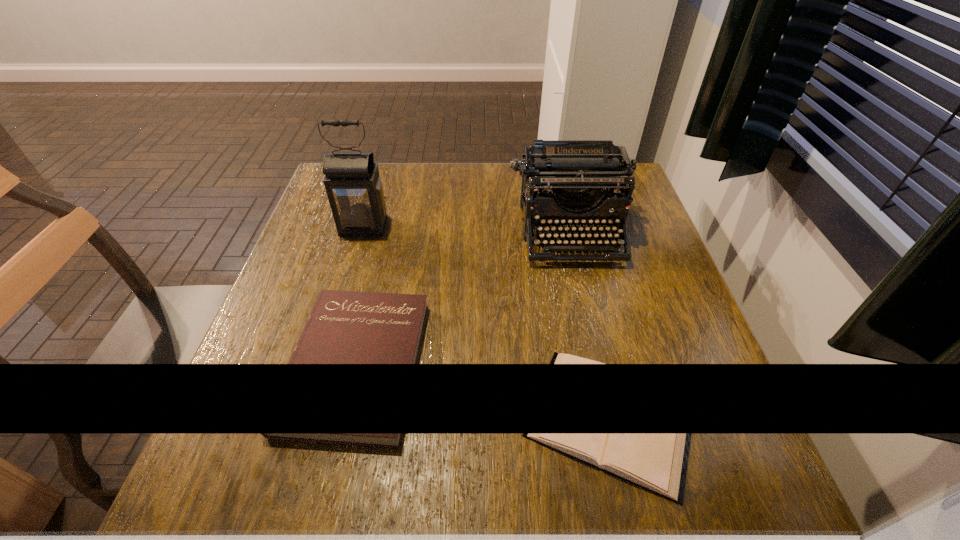
In the image, there is a desktop. Identify the location of vacant space at the right edge. Image resolution: width=960 pixels, height=540 pixels. (674, 417).

This screenshot has width=960, height=540. What are the coordinates of `free region at the near right corner of the desktop` in the screenshot? It's located at tap(650, 462).

The width and height of the screenshot is (960, 540). In order to click on blank region between the typewriter and the third tallest object in this screenshot , I will do `click(464, 298)`.

The height and width of the screenshot is (540, 960). Identify the location of unoccupied area between the second tallest object and the taller hardback book. (464, 298).

The width and height of the screenshot is (960, 540). I want to click on unoccupied position between the second shortest object and the third shortest object, so click(464, 298).

Locate an element on the screen. empty space that is in between the tallest object and the shorter hardback book is located at coordinates (487, 322).

I want to click on free space between the taller hardback book and the typewriter, so click(464, 298).

In order to click on free area in between the lantern and the shorter hardback book in this screenshot , I will do `click(487, 322)`.

I want to click on empty space that is in between the taller hardback book and the right hardback book, so click(x=483, y=390).

I want to click on free space between the typewriter and the tallest object, so click(x=467, y=230).